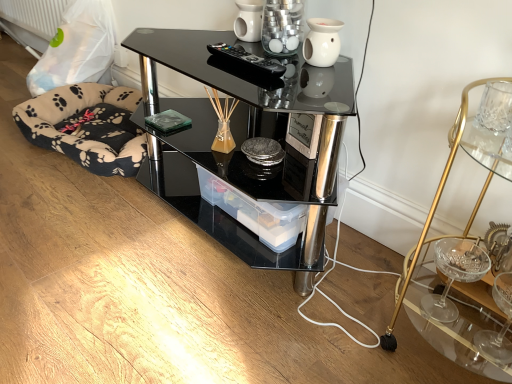
Question: From a real-world perspective, is transparent plastic container at center over gold metallic cocktail table at right?

Choices:
 (A) yes
 (B) no

Answer: (B)

Question: From the image's perspective, is transparent plastic container at center located above gold metallic cocktail table at right?

Choices:
 (A) yes
 (B) no

Answer: (A)

Question: Considering the relative sizes of transparent plastic container at center and gold metallic cocktail table at right in the image provided, is transparent plastic container at center bigger than gold metallic cocktail table at right?

Choices:
 (A) no
 (B) yes

Answer: (A)

Question: Is transparent plastic container at center facing away from gold metallic cocktail table at right?

Choices:
 (A) yes
 (B) no

Answer: (B)

Question: From a real-world perspective, is transparent plastic container at center under gold metallic cocktail table at right?

Choices:
 (A) no
 (B) yes

Answer: (B)

Question: Based on their sizes in the image, would you say black glass desk at center is bigger or smaller than gold metallic cocktail table at right?

Choices:
 (A) big
 (B) small

Answer: (A)

Question: Choose the correct answer: Is black glass desk at center inside gold metallic cocktail table at right or outside it?

Choices:
 (A) inside
 (B) outside

Answer: (B)

Question: Is black glass desk at center taller or shorter than gold metallic cocktail table at right?

Choices:
 (A) tall
 (B) short

Answer: (B)

Question: Is point (330, 76) positioned closer to the camera than point (393, 344)?

Choices:
 (A) farther
 (B) closer

Answer: (A)

Question: Looking at their shapes, would you say white ceramic candle holder at upper center is wider or thinner than gold metallic cocktail table at right?

Choices:
 (A) wide
 (B) thin

Answer: (B)

Question: Relative to gold metallic cocktail table at right, is white ceramic candle holder at upper center in front or behind?

Choices:
 (A) behind
 (B) front

Answer: (A)

Question: From a real-world perspective, is white ceramic candle holder at upper center above or below gold metallic cocktail table at right?

Choices:
 (A) below
 (B) above

Answer: (B)

Question: Is white ceramic candle holder at upper center taller or shorter than gold metallic cocktail table at right?

Choices:
 (A) short
 (B) tall

Answer: (A)

Question: Is point (48, 104) positioned closer to the camera than point (237, 67)?

Choices:
 (A) farther
 (B) closer

Answer: (A)

Question: Would you say black fleece dog bed at lower left is inside or outside black plastic remote at upper center?

Choices:
 (A) inside
 (B) outside

Answer: (B)